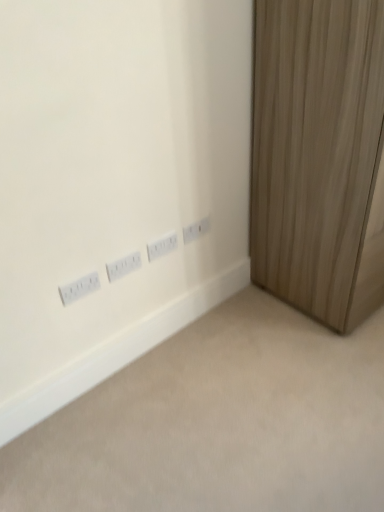
The width and height of the screenshot is (384, 512). Describe the element at coordinates (123, 266) in the screenshot. I see `white plastic power plugs and sockets at center, the 3th power plugs and sockets viewed from the right` at that location.

Image resolution: width=384 pixels, height=512 pixels. Identify the location of white plastic power plugs and sockets at center, the second power plugs and sockets from the right. (162, 246).

Image resolution: width=384 pixels, height=512 pixels. Identify the location of white plastic power plugs and sockets at center, the 4th power plugs and sockets in the left-to-right sequence. (196, 229).

Which is in front, white plastic power plugs and sockets at lower left, marked as the 4th power plugs and sockets in a right-to-left arrangement, or white plastic power plugs and sockets at center, the 3th power plugs and sockets in the left-to-right sequence?

white plastic power plugs and sockets at lower left, marked as the 4th power plugs and sockets in a right-to-left arrangement, is closer to the camera.

This screenshot has height=512, width=384. There is a white plastic power plugs and sockets at lower left, marked as the 4th power plugs and sockets in a right-to-left arrangement. Find the location of `the 2nd power plugs and sockets above it (from the image's perspective)`. the 2nd power plugs and sockets above it (from the image's perspective) is located at coordinates (162, 246).

From a real-world perspective, who is located higher, white plastic power plugs and sockets at lower left, which appears as the first power plugs and sockets when viewed from the left, or white plastic power plugs and sockets at center, the 3th power plugs and sockets in the left-to-right sequence?

In real-world perspective, white plastic power plugs and sockets at lower left, which appears as the first power plugs and sockets when viewed from the left, is above.

From the image's perspective, which one is positioned lower, white plastic power plugs and sockets at center, marked as the 2th power plugs and sockets in a left-to-right arrangement, or wooden curtain at right?

white plastic power plugs and sockets at center, marked as the 2th power plugs and sockets in a left-to-right arrangement.

From a real-world perspective, is white plastic power plugs and sockets at center, the 3th power plugs and sockets viewed from the right, positioned above or below wooden curtain at right?

white plastic power plugs and sockets at center, the 3th power plugs and sockets viewed from the right, is situated lower than wooden curtain at right in the real world.

Who is bigger, white plastic power plugs and sockets at center, marked as the 2th power plugs and sockets in a left-to-right arrangement, or wooden curtain at right?

wooden curtain at right is bigger.

From the wooden curtain at right, count the 3rd power plugs and sockets to the left and point to it. Please provide its 2D coordinates.

[(123, 266)]

Locate an element on the screen. power plugs and sockets that appears below the white plastic power plugs and sockets at center, marked as the 2th power plugs and sockets in a left-to-right arrangement (from the image's perspective) is located at coordinates (79, 288).

Is white plastic power plugs and sockets at center, the 3th power plugs and sockets viewed from the right, oriented towards white plastic power plugs and sockets at lower left, marked as the 4th power plugs and sockets in a right-to-left arrangement?

No.

Visually, is white plastic power plugs and sockets at center, the 3th power plugs and sockets viewed from the right, positioned to the left or to the right of white plastic power plugs and sockets at lower left, marked as the 4th power plugs and sockets in a right-to-left arrangement?

Clearly, white plastic power plugs and sockets at center, the 3th power plugs and sockets viewed from the right, is on the right of white plastic power plugs and sockets at lower left, marked as the 4th power plugs and sockets in a right-to-left arrangement, in the image.

Between white plastic power plugs and sockets at center, the 3th power plugs and sockets viewed from the right, and white plastic power plugs and sockets at lower left, marked as the 4th power plugs and sockets in a right-to-left arrangement, which one has smaller size?

white plastic power plugs and sockets at lower left, marked as the 4th power plugs and sockets in a right-to-left arrangement.

Considering the sizes of white plastic power plugs and sockets at center, marked as the 2th power plugs and sockets in a left-to-right arrangement, and white plastic power plugs and sockets at center, the 4th power plugs and sockets in the left-to-right sequence, in the image, is white plastic power plugs and sockets at center, marked as the 2th power plugs and sockets in a left-to-right arrangement, taller or shorter than white plastic power plugs and sockets at center, the 4th power plugs and sockets in the left-to-right sequence,?

In the image, white plastic power plugs and sockets at center, marked as the 2th power plugs and sockets in a left-to-right arrangement, appears to be taller than white plastic power plugs and sockets at center, the 4th power plugs and sockets in the left-to-right sequence.

Can you tell me how much white plastic power plugs and sockets at center, marked as the 2th power plugs and sockets in a left-to-right arrangement, and white plastic power plugs and sockets at center, the 4th power plugs and sockets in the left-to-right sequence, differ in facing direction?

There is a 0-degree angle between the facing directions of white plastic power plugs and sockets at center, marked as the 2th power plugs and sockets in a left-to-right arrangement, and white plastic power plugs and sockets at center, the 4th power plugs and sockets in the left-to-right sequence.

Which is behind, point (119, 264) or point (203, 223)?

Point (203, 223)

Considering the positions of objects white plastic power plugs and sockets at center, the 3th power plugs and sockets viewed from the right, and white plastic power plugs and sockets at center, the 4th power plugs and sockets in the left-to-right sequence, in the image provided, who is more to the left, white plastic power plugs and sockets at center, the 3th power plugs and sockets viewed from the right, or white plastic power plugs and sockets at center, the 4th power plugs and sockets in the left-to-right sequence,?

From the viewer's perspective, white plastic power plugs and sockets at center, the 3th power plugs and sockets viewed from the right, appears more on the left side.

Are wooden curtain at right and white plastic outlets at lower left far apart?

wooden curtain at right is actually quite close to white plastic outlets at lower left.

Is wooden curtain at right to the left of white plastic outlets at lower left from the viewer's perspective?

Incorrect, wooden curtain at right is not on the left side of white plastic outlets at lower left.

Measure the distance from wooden curtain at right to white plastic outlets at lower left.

wooden curtain at right and white plastic outlets at lower left are 28.12 inches apart from each other.

From the image's perspective, would you say wooden curtain at right is positioned over white plastic outlets at lower left?

Yes, from the image's perspective, wooden curtain at right is on top of white plastic outlets at lower left.

Which is farther, (x=201, y=229) or (x=170, y=237)?

The point (x=201, y=229) is farther.

The width and height of the screenshot is (384, 512). In order to click on power plugs and sockets behind the white plastic power plugs and sockets at center, the 3th power plugs and sockets in the left-to-right sequence in this screenshot , I will do (196, 229).

From a real-world perspective, is white plastic power plugs and sockets at center, which ranks as the first power plugs and sockets in right-to-left order, beneath white plastic power plugs and sockets at center, the 3th power plugs and sockets in the left-to-right sequence?

No, from a real-world perspective, white plastic power plugs and sockets at center, which ranks as the first power plugs and sockets in right-to-left order, is not under white plastic power plugs and sockets at center, the 3th power plugs and sockets in the left-to-right sequence.

Does white plastic power plugs and sockets at center, the 4th power plugs and sockets in the left-to-right sequence, have a greater width compared to white plastic power plugs and sockets at center, the 3th power plugs and sockets in the left-to-right sequence?

In fact, white plastic power plugs and sockets at center, the 4th power plugs and sockets in the left-to-right sequence, might be narrower than white plastic power plugs and sockets at center, the 3th power plugs and sockets in the left-to-right sequence.

From the image's perspective, does white plastic power plugs and sockets at lower left, marked as the 4th power plugs and sockets in a right-to-left arrangement, appear higher than white plastic power plugs and sockets at center, which ranks as the first power plugs and sockets in right-to-left order?

Incorrect, from the image's perspective, white plastic power plugs and sockets at lower left, marked as the 4th power plugs and sockets in a right-to-left arrangement, is lower than white plastic power plugs and sockets at center, which ranks as the first power plugs and sockets in right-to-left order.

Which of these two, white plastic power plugs and sockets at lower left, marked as the 4th power plugs and sockets in a right-to-left arrangement, or white plastic power plugs and sockets at center, which ranks as the first power plugs and sockets in right-to-left order, is wider?

Wider between the two is white plastic power plugs and sockets at lower left, marked as the 4th power plugs and sockets in a right-to-left arrangement.

Where is `power plugs and sockets that is the 3rd one when counting downward from the white plastic power plugs and sockets at center, which ranks as the first power plugs and sockets in right-to-left order (from the image's perspective)`? This screenshot has width=384, height=512. power plugs and sockets that is the 3rd one when counting downward from the white plastic power plugs and sockets at center, which ranks as the first power plugs and sockets in right-to-left order (from the image's perspective) is located at coordinates (79, 288).

Is point (66, 285) farther from camera compared to point (190, 227)?

No, (66, 285) is closer to viewer.

This screenshot has height=512, width=384. Find the location of `the 2nd power plugs and sockets to the left of the white plastic power plugs and sockets at center, the second power plugs and sockets from the right, counting from the anchor's position`. the 2nd power plugs and sockets to the left of the white plastic power plugs and sockets at center, the second power plugs and sockets from the right, counting from the anchor's position is located at coordinates (79, 288).

Where is `the 3rd power plugs and sockets below the wooden curtain at right (from a real-world perspective)`? This screenshot has width=384, height=512. the 3rd power plugs and sockets below the wooden curtain at right (from a real-world perspective) is located at coordinates click(123, 266).

From the image, which object appears to be farther from white plastic power plugs and sockets at lower left, marked as the 4th power plugs and sockets in a right-to-left arrangement, white plastic power plugs and sockets at center, the second power plugs and sockets from the right, or white plastic power plugs and sockets at center, the 4th power plugs and sockets in the left-to-right sequence?

white plastic power plugs and sockets at center, the 4th power plugs and sockets in the left-to-right sequence, lies further to white plastic power plugs and sockets at lower left, marked as the 4th power plugs and sockets in a right-to-left arrangement, than the other object.

Which object lies further to the anchor point white plastic power plugs and sockets at center, which ranks as the first power plugs and sockets in right-to-left order, white plastic power plugs and sockets at center, the 3th power plugs and sockets in the left-to-right sequence, or white plastic power plugs and sockets at center, marked as the 2th power plugs and sockets in a left-to-right arrangement?

white plastic power plugs and sockets at center, marked as the 2th power plugs and sockets in a left-to-right arrangement, is further to white plastic power plugs and sockets at center, which ranks as the first power plugs and sockets in right-to-left order.

Based on their spatial positions, is white plastic outlets at lower left or white plastic power plugs and sockets at center, the second power plugs and sockets from the right, further from wooden curtain at right?

Based on the image, white plastic outlets at lower left appears to be further to wooden curtain at right.

Estimate the real-world distances between objects in this image. Which object is closer to white plastic outlets at lower left, wooden curtain at right or white plastic power plugs and sockets at center, marked as the 2th power plugs and sockets in a left-to-right arrangement?

Based on the image, white plastic power plugs and sockets at center, marked as the 2th power plugs and sockets in a left-to-right arrangement, appears to be nearer to white plastic outlets at lower left.

Which object lies further to the anchor point white plastic power plugs and sockets at center, marked as the 2th power plugs and sockets in a left-to-right arrangement, white plastic power plugs and sockets at lower left, which appears as the first power plugs and sockets when viewed from the left, or white plastic power plugs and sockets at center, the 4th power plugs and sockets in the left-to-right sequence?

white plastic power plugs and sockets at center, the 4th power plugs and sockets in the left-to-right sequence, is positioned further to the anchor white plastic power plugs and sockets at center, marked as the 2th power plugs and sockets in a left-to-right arrangement.

When comparing their distances from white plastic power plugs and sockets at center, marked as the 2th power plugs and sockets in a left-to-right arrangement, does white plastic power plugs and sockets at center, which ranks as the first power plugs and sockets in right-to-left order, or white plastic outlets at lower left seem closer?

white plastic power plugs and sockets at center, which ranks as the first power plugs and sockets in right-to-left order.

Considering their positions, is white plastic power plugs and sockets at center, marked as the 2th power plugs and sockets in a left-to-right arrangement, positioned closer to white plastic power plugs and sockets at center, the 4th power plugs and sockets in the left-to-right sequence, than white plastic power plugs and sockets at lower left, which appears as the first power plugs and sockets when viewed from the left?

white plastic power plugs and sockets at center, marked as the 2th power plugs and sockets in a left-to-right arrangement, lies closer to white plastic power plugs and sockets at center, the 4th power plugs and sockets in the left-to-right sequence, than the other object.

Based on their spatial positions, is wooden curtain at right or white plastic outlets at lower left further from white plastic power plugs and sockets at center, the second power plugs and sockets from the right?

The object further to white plastic power plugs and sockets at center, the second power plugs and sockets from the right, is white plastic outlets at lower left.

What are the coordinates of `plain between white plastic power plugs and sockets at center, marked as the 2th power plugs and sockets in a left-to-right arrangement, and wooden curtain at right, in the horizontal direction` in the screenshot? It's located at (219, 422).

Image resolution: width=384 pixels, height=512 pixels. I want to click on power plugs and sockets between white plastic power plugs and sockets at center, the 3th power plugs and sockets in the left-to-right sequence, and wooden curtain at right from left to right, so click(x=196, y=229).

Locate an element on the screen. power plugs and sockets between white plastic power plugs and sockets at lower left, marked as the 4th power plugs and sockets in a right-to-left arrangement, and white plastic power plugs and sockets at center, the second power plugs and sockets from the right is located at coordinates (123, 266).

I want to click on plain between white plastic power plugs and sockets at lower left, marked as the 4th power plugs and sockets in a right-to-left arrangement, and wooden curtain at right, so click(x=219, y=422).